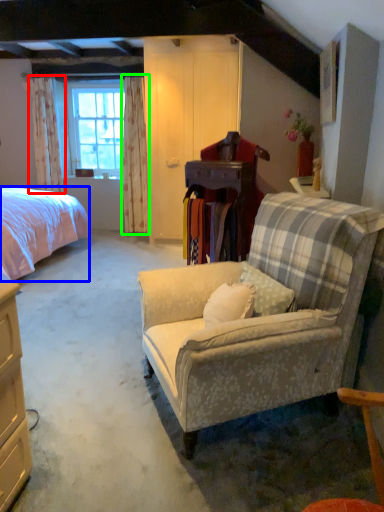
Question: Based on their relative distances, which object is farther from curtain (highlighted by a red box)? Choose from bed (highlighted by a blue box) and curtain (highlighted by a green box).

Choices:
 (A) bed
 (B) curtain

Answer: (A)